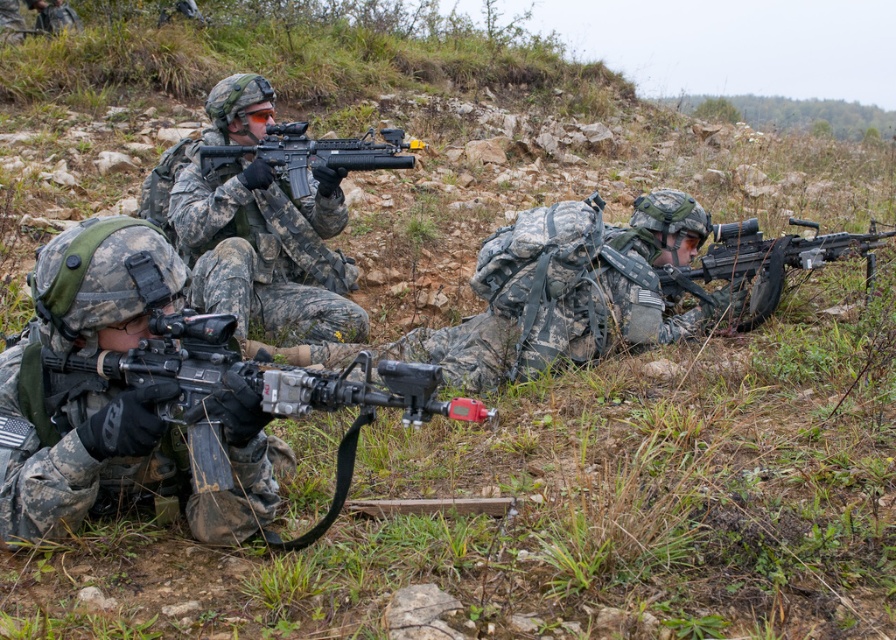
Where is the camouflage uniform at center located in the image?

The camouflage uniform at center is located at point (266,252) in the image.

You are a soldier in the group and need to quickly identify the tallest object between the camouflage uniform at center and the matte black machine gun at lower left. Which one should you choose?

The camouflage uniform at center is taller than the matte black machine gun at lower left, so you should choose the camouflage uniform at center as the tallest object.